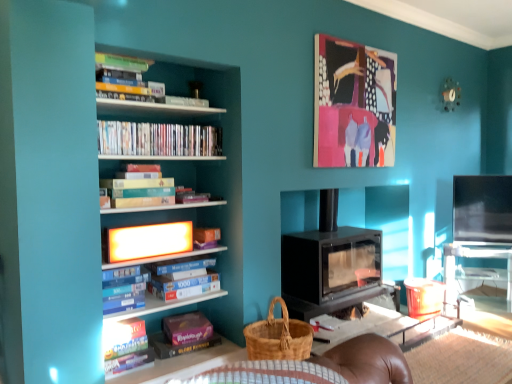
What do you see at coordinates (330, 265) in the screenshot? This screenshot has width=512, height=384. I see `black matte wood burning stove at center` at bounding box center [330, 265].

At what (x,y) coordinates should I click in order to perform the action: click on matte plastic dvds at upper left, which is the 1th book from top to bottom. Please return your answer as a coordinate pair (x, y). Looking at the image, I should click on (158, 139).

This screenshot has width=512, height=384. In order to click on hardcover books at center, which ranks as the second book in top-to-bottom order in this screenshot , I will do `click(137, 191)`.

What is the approximate width of white glossy bookshelf at left?

27.19 inches.

Where is `matte cardboard book at lower left, positioned as the 5th book in top-to-bottom order`? The height and width of the screenshot is (384, 512). matte cardboard book at lower left, positioned as the 5th book in top-to-bottom order is located at coordinates (126, 347).

Does transparent plastic table at right turn towards blue cardboard box at left, which is the 2th book from bottom to top?

No, transparent plastic table at right is not facing towards blue cardboard box at left, which is the 2th book from bottom to top.

Would you say transparent plastic table at right is to the left or to the right of blue cardboard box at left, which is the 2th book from bottom to top, in the picture?

Based on their positions, transparent plastic table at right is located to the right of blue cardboard box at left, which is the 2th book from bottom to top.

Considering the sizes of transparent plastic table at right and blue cardboard box at left, the 4th book when ordered from top to bottom, in the image, is transparent plastic table at right bigger or smaller than blue cardboard box at left, the 4th book when ordered from top to bottom,?

transparent plastic table at right is bigger than blue cardboard box at left, the 4th book when ordered from top to bottom.

From the image's perspective, does transparent plastic table at right appear higher than blue cardboard box at left, which is the 2th book from bottom to top?

No, from the image's perspective, transparent plastic table at right is not above blue cardboard box at left, which is the 2th book from bottom to top.

From the image's perspective, relative to black matte wood burning stove at center, is hardcover books at center, the fourth book positioned from the bottom, above or below?

Clearly, from the image's perspective, hardcover books at center, the fourth book positioned from the bottom, is above black matte wood burning stove at center.

Looking at this image, from a real-world perspective, is hardcover books at center, which ranks as the second book in top-to-bottom order, positioned over black matte wood burning stove at center based on gravity?

Yes, from a real-world perspective, hardcover books at center, which ranks as the second book in top-to-bottom order, is above black matte wood burning stove at center.

Is hardcover books at center, the fourth book positioned from the bottom, smaller than black matte wood burning stove at center?

Correct, hardcover books at center, the fourth book positioned from the bottom, occupies less space than black matte wood burning stove at center.

Based on the photo, which of these two, matte cardboard book at lower left, which is counted as the first book, starting from the bottom, or black matte wood burning stove at center, is bigger?

black matte wood burning stove at center is bigger.

Is black matte wood burning stove at center at the back of matte cardboard book at lower left, positioned as the 5th book in top-to-bottom order?

matte cardboard book at lower left, positioned as the 5th book in top-to-bottom order, is not turned away from black matte wood burning stove at center.

Based on the photo, considering their positions, is matte cardboard book at lower left, positioned as the 5th book in top-to-bottom order, located in front of or behind black matte wood burning stove at center?

In the image, matte cardboard book at lower left, positioned as the 5th book in top-to-bottom order, appears in front of black matte wood burning stove at center.

Measure the distance from matte cardboard book at lower left, which is counted as the first book, starting from the bottom, to black matte wood burning stove at center.

A distance of 4.74 feet exists between matte cardboard book at lower left, which is counted as the first book, starting from the bottom, and black matte wood burning stove at center.

Which object is wider, hardcover books at center, the fourth book positioned from the bottom, or transparent plastic table at right?

transparent plastic table at right.

Where is `table below the hardcover books at center, which ranks as the second book in top-to-bottom order (from a real-world perspective)`? Image resolution: width=512 pixels, height=384 pixels. table below the hardcover books at center, which ranks as the second book in top-to-bottom order (from a real-world perspective) is located at coordinates 474,273.

From the image's perspective, which is above, hardcover books at center, the fourth book positioned from the bottom, or transparent plastic table at right?

hardcover books at center, the fourth book positioned from the bottom, from the image's perspective.

Choose the correct answer: Is hardcover books at center, the fourth book positioned from the bottom, inside transparent plastic table at right or outside it?

hardcover books at center, the fourth book positioned from the bottom, is spatially situated outside transparent plastic table at right.

Does blue cardboard puzzle at upper left, marked as the third book in a bottom-to-top arrangement, come in front of transparent plastic table at right?

Yes, it is.

Is blue cardboard puzzle at upper left, marked as the third book in a bottom-to-top arrangement, positioned with its back to transparent plastic table at right?

blue cardboard puzzle at upper left, marked as the third book in a bottom-to-top arrangement, does not have its back to transparent plastic table at right.

Can you tell me how much blue cardboard puzzle at upper left, the third book when ordered from top to bottom, and transparent plastic table at right differ in facing direction?

There is a 47.1-degree angle between the facing directions of blue cardboard puzzle at upper left, the third book when ordered from top to bottom, and transparent plastic table at right.

Looking at this image, from a real-world perspective, is blue cardboard puzzle at upper left, marked as the third book in a bottom-to-top arrangement, physically located above or below transparent plastic table at right?

blue cardboard puzzle at upper left, marked as the third book in a bottom-to-top arrangement, is above transparent plastic table at right.

Which is less distant, (205, 155) or (221, 202)?

The point (205, 155) is closer to the camera.

Which of these two, matte plastic dvds at upper left, which appears as the 5th book when ordered from the bottom, or bright orange plastic shelf at upper center, is smaller?

Smaller between the two is bright orange plastic shelf at upper center.

Which object is further away from the camera taking this photo, matte plastic dvds at upper left, which appears as the 5th book when ordered from the bottom, or bright orange plastic shelf at upper center?

bright orange plastic shelf at upper center.

Who is shorter, white glossy bookshelf at left or black matte wood burning stove at center?

Standing shorter between the two is black matte wood burning stove at center.

Is white glossy bookshelf at left completely or partially outside of black matte wood burning stove at center?

That's correct, white glossy bookshelf at left is outside of black matte wood burning stove at center.

Is white glossy bookshelf at left bigger or smaller than black matte wood burning stove at center?

Considering their sizes, white glossy bookshelf at left takes up more space than black matte wood burning stove at center.

Can you confirm if white glossy bookshelf at left is positioned to the right of black matte wood burning stove at center?

No, white glossy bookshelf at left is not to the right of black matte wood burning stove at center.

The image size is (512, 384). I want to click on the 2nd book above the transparent plastic table at right (from a real-world perspective), so click(125, 292).

Locate an element on the screen. Image resolution: width=512 pixels, height=384 pixels. wood burning stove lying on the right of hardcover books at center, the fourth book positioned from the bottom is located at coordinates (330, 265).

Looking at the image, which one is located further to matte plastic dvds at upper left, which appears as the 5th book when ordered from the bottom, abstract painting at upper center or transparent plastic table at right?

Among the two, transparent plastic table at right is located further to matte plastic dvds at upper left, which appears as the 5th book when ordered from the bottom.

Estimate the real-world distances between objects in this image. Which object is closer to woven brown basket at lower center, transparent plastic table at right or abstract painting at upper center?

abstract painting at upper center lies closer to woven brown basket at lower center than the other object.

Looking at the image, which one is located further to woven brown basket at lower center, transparent plastic table at right or blue cardboard puzzle at upper left, the third book when ordered from top to bottom?

transparent plastic table at right is positioned further to the anchor woven brown basket at lower center.

Looking at the image, which one is located further to woven brown basket at lower center, matte cardboard book at lower left, which is counted as the first book, starting from the bottom, or abstract painting at upper center?

abstract painting at upper center.

Which object lies further to the anchor point transparent plastic table at right, white glossy bookshelf at left or matte cardboard book at lower left, which is counted as the first book, starting from the bottom?

Based on the image, matte cardboard book at lower left, which is counted as the first book, starting from the bottom, appears to be further to transparent plastic table at right.

Looking at the image, which one is located closer to white glossy bookshelf at left, matte cardboard book at lower left, which is counted as the first book, starting from the bottom, or hardcover books at center, the fourth book positioned from the bottom?

Among the two, hardcover books at center, the fourth book positioned from the bottom, is located nearer to white glossy bookshelf at left.

Considering their positions, is transparent plastic table at right positioned closer to blue cardboard puzzle at upper left, the third book when ordered from top to bottom, than hardcover books at center, the fourth book positioned from the bottom?

hardcover books at center, the fourth book positioned from the bottom, is positioned closer to the anchor blue cardboard puzzle at upper left, the third book when ordered from top to bottom.

From the image, which object appears to be farther from matte cardboard book at lower left, positioned as the 5th book in top-to-bottom order, blue cardboard puzzle at upper left, the third book when ordered from top to bottom, or woven brown basket at lower center?

woven brown basket at lower center is positioned further to the anchor matte cardboard book at lower left, positioned as the 5th book in top-to-bottom order.

Image resolution: width=512 pixels, height=384 pixels. I want to click on bookcase between matte plastic dvds at upper left, which is the 1th book from top to bottom, and matte cardboard book at lower left, which is counted as the first book, starting from the bottom, from top to bottom, so click(196, 169).

In order to click on wood burning stove between white glossy bookshelf at left and abstract painting at upper center in the horizontal direction in this screenshot , I will do `click(330, 265)`.

Locate an element on the screen. The width and height of the screenshot is (512, 384). shelf between matte plastic dvds at upper left, which appears as the 5th book when ordered from the bottom, and blue cardboard puzzle at upper left, marked as the third book in a bottom-to-top arrangement, in the up-down direction is located at coordinates (138, 257).

Identify the location of basket between blue cardboard box at left, the 4th book when ordered from top to bottom, and black matte wood burning stove at center. Image resolution: width=512 pixels, height=384 pixels. (278, 337).